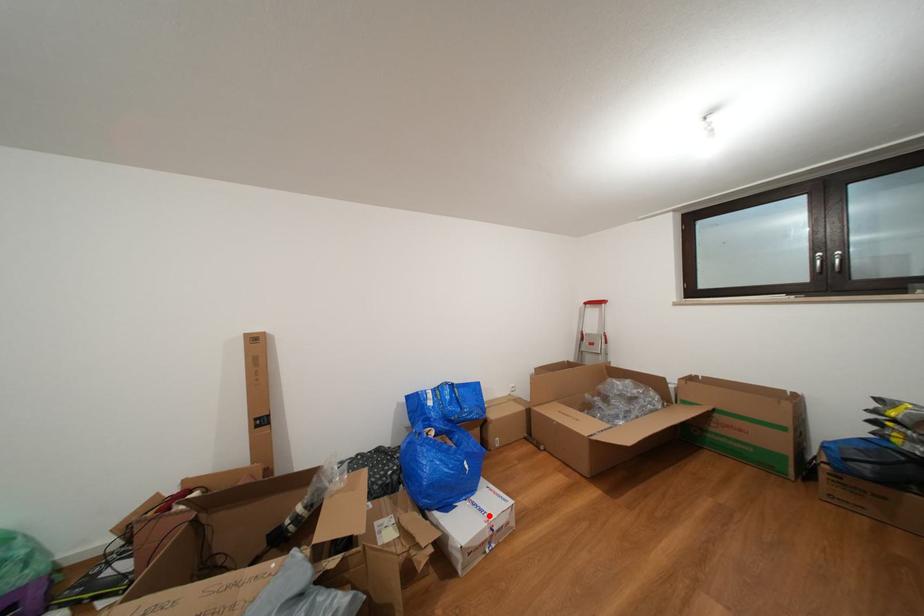
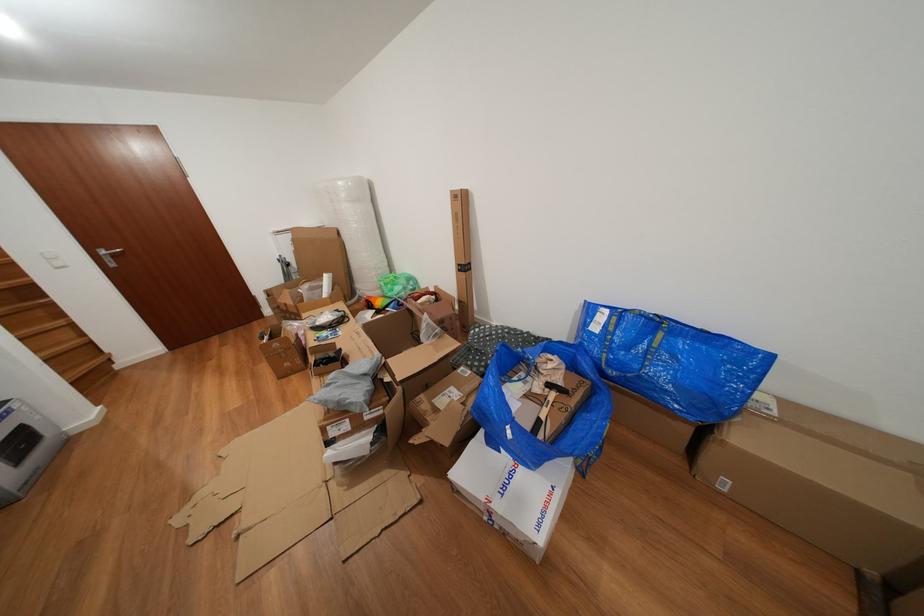
Question: I am providing you with two images of the same scene from different viewpoints. A red point is shown in image1. For the corresponding object point in image2, is it positioned nearer or farther from the camera?

Choices:
 (A) Nearer
 (B) Farther

Answer: (A)